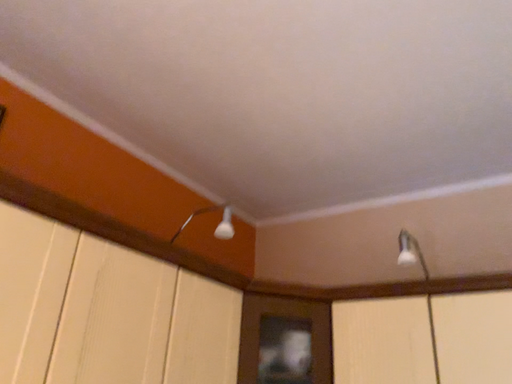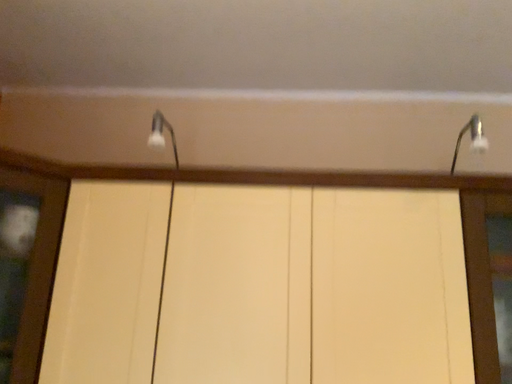
Question: How did the camera likely rotate when shooting the video?

Choices:
 (A) rotated upward
 (B) rotated downward

Answer: (B)